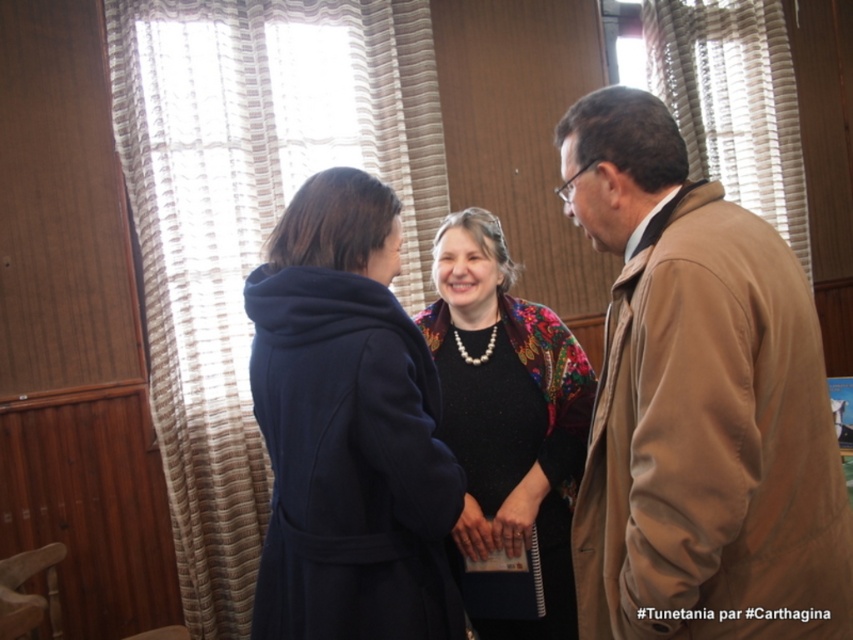
You are a fashion designer observing the scene. You need to determine the spatial arrangement of the coats. Which coat is positioned to the left between the dark blue wool coat at center and the matte blue coat at center?

The matte blue coat at center is positioned to the left of the dark blue wool coat at center.

You are standing in the room and want to place a small potted plant between the two points, point (590, 476) and point (550, 488). Which point should the plant be closer to so that it appears centered between them?

The plant should be placed closer to point (550, 488) because point (590, 476) is in front of point (550, 488), meaning the latter is behind. To center the plant between them, it needs to be positioned closer to the rear point.

You are standing at point (289,262) and want to walk to point (582,596). Which direction should you move in to reach your destination?

To reach point (582,596) from point (289,262), you should move forward since point (582,596) is in front of point (289,262).